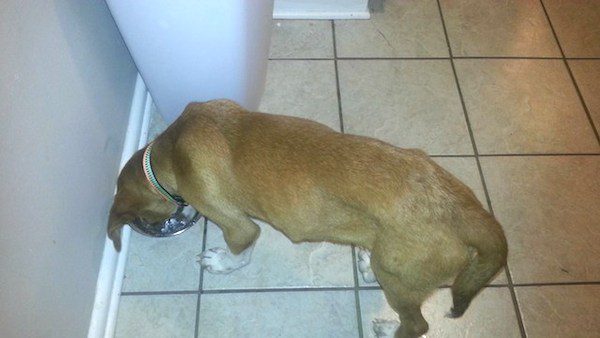
Image resolution: width=600 pixels, height=338 pixels. I want to click on meeting corners of the tile lines, so click(x=200, y=293), click(x=357, y=288), click(x=511, y=285), click(x=477, y=155), click(x=565, y=60), click(x=451, y=59), click(x=336, y=60).